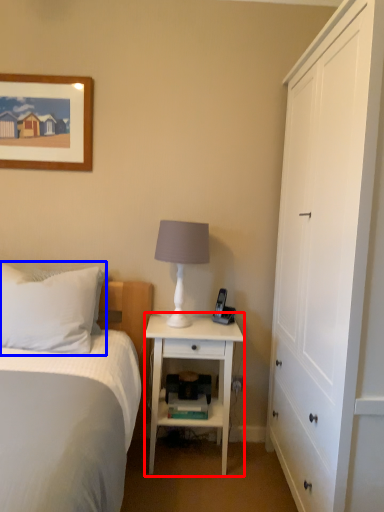
Question: Which object is further to the camera taking this photo, nightstand (highlighted by a red box) or pillow (highlighted by a blue box)?

Choices:
 (A) nightstand
 (B) pillow

Answer: (A)